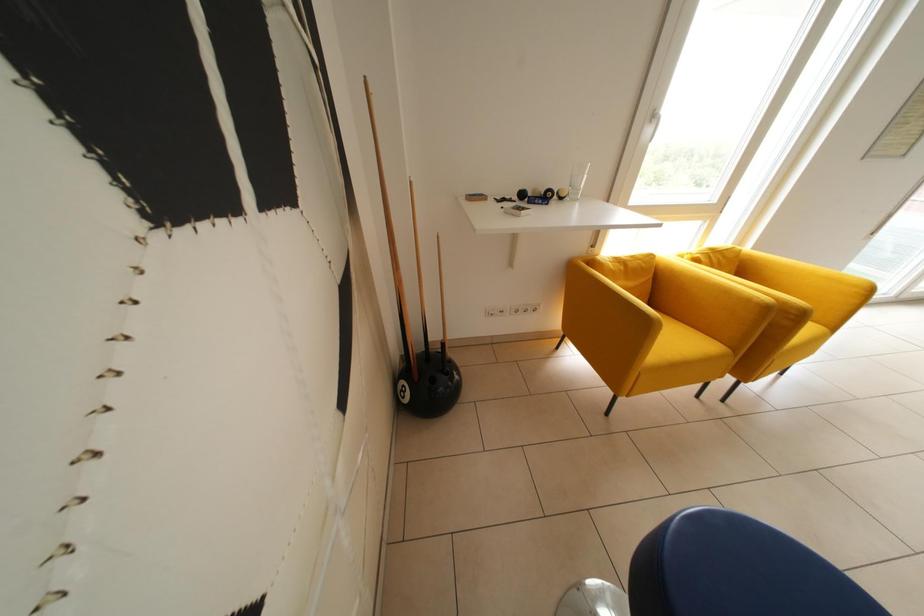
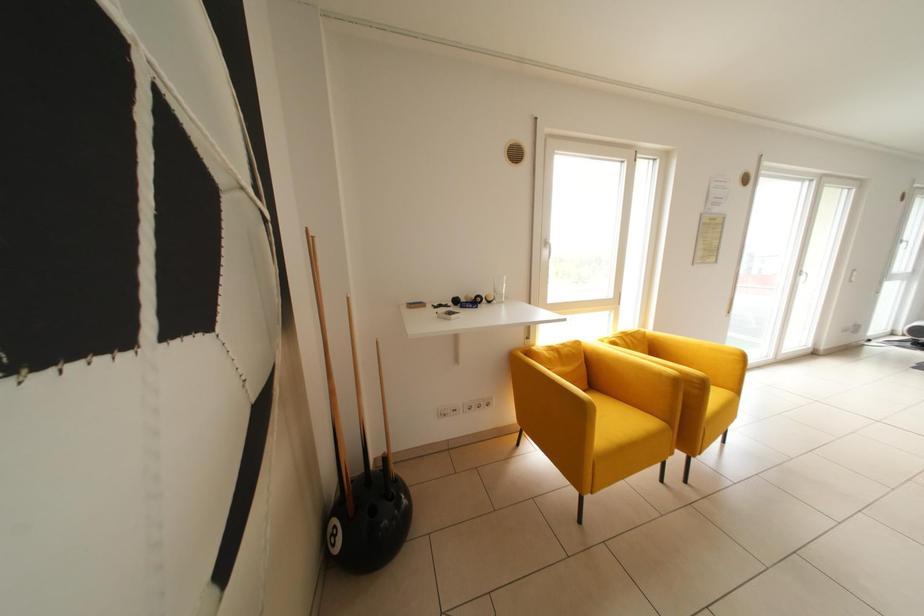
What movement of the cameraman would produce the second image?

The cameraman moved toward right, backward.